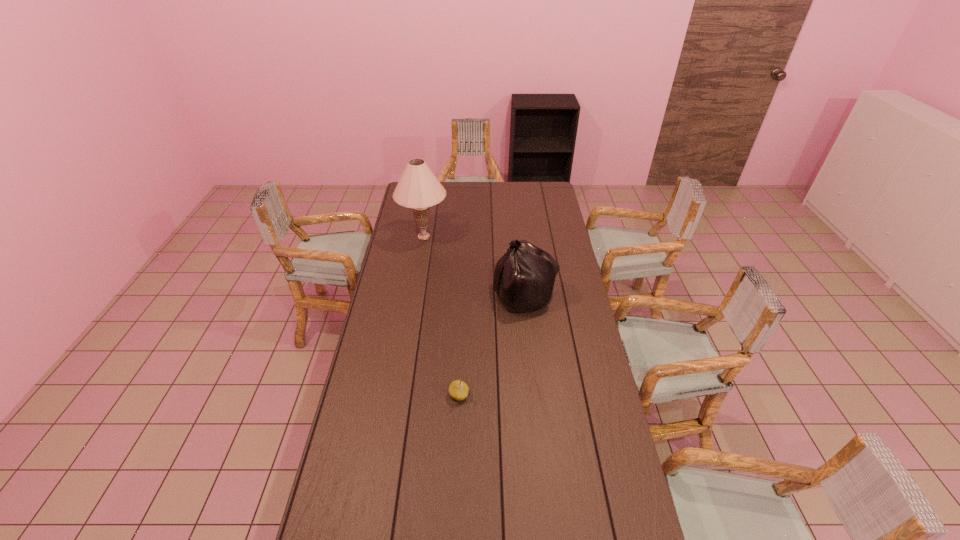
Find the location of a particular element. This screenshot has height=540, width=960. the tallest object is located at coordinates (418, 188).

Where is `the leftmost object`? This screenshot has width=960, height=540. the leftmost object is located at coordinates (418, 188).

The width and height of the screenshot is (960, 540). I want to click on the second shortest object, so click(524, 277).

At what (x,y) coordinates should I click in order to perform the action: click on the second nearest object. Please return your answer as a coordinate pair (x, y). This screenshot has height=540, width=960. Looking at the image, I should click on (524, 277).

Where is `the nearest object`? Image resolution: width=960 pixels, height=540 pixels. the nearest object is located at coordinates (458, 389).

At what (x,y) coordinates should I click in order to perform the action: click on the shortest object. Please return your answer as a coordinate pair (x, y). Image resolution: width=960 pixels, height=540 pixels. Looking at the image, I should click on (458, 389).

The width and height of the screenshot is (960, 540). What are the coordinates of `free spot located 0.200m on the front of the lampshade` in the screenshot? It's located at (417, 278).

You are a GUI agent. You are given a task and a screenshot of the screen. Output one action in this format:
    pyautogui.click(x=<x>, y=<y>)
    Task: Click on the blank space located 0.080m on the front of the plastic bag
    
    Given the screenshot: What is the action you would take?
    pyautogui.click(x=529, y=332)

I want to click on vacant area located 0.140m on the right of the nearest object, so click(x=508, y=395).

The height and width of the screenshot is (540, 960). In order to click on object that is at the left edge in this screenshot , I will do coord(418,188).